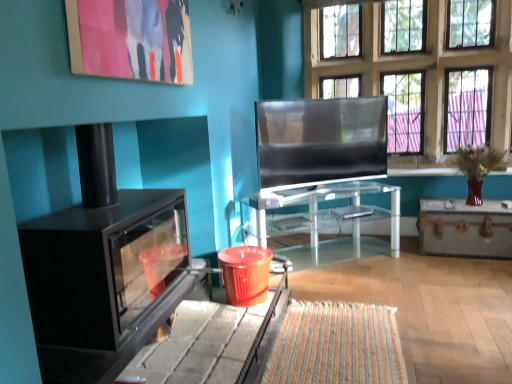
Question: Is matte black tv at center positioned with its back to black matte fireplace at left?

Choices:
 (A) no
 (B) yes

Answer: (A)

Question: Does matte black tv at center have a lesser height compared to black matte fireplace at left?

Choices:
 (A) yes
 (B) no

Answer: (A)

Question: Is black matte fireplace at left completely or partially inside matte black tv at center?

Choices:
 (A) yes
 (B) no

Answer: (B)

Question: Is matte black tv at center outside black matte fireplace at left?

Choices:
 (A) no
 (B) yes

Answer: (B)

Question: Is matte black tv at center to the right of black matte fireplace at left from the viewer's perspective?

Choices:
 (A) yes
 (B) no

Answer: (A)

Question: Considering the relative sizes of matte black tv at center and black matte fireplace at left in the image provided, is matte black tv at center bigger than black matte fireplace at left?

Choices:
 (A) no
 (B) yes

Answer: (A)

Question: Is metallic trunk at right, the second table when ordered from left to right, a part of matte acrylic painting at upper left?

Choices:
 (A) yes
 (B) no

Answer: (B)

Question: From a real-world perspective, is matte acrylic painting at upper left physically below metallic trunk at right, acting as the 1th table starting from the right?

Choices:
 (A) yes
 (B) no

Answer: (B)

Question: Does matte acrylic painting at upper left have a greater width compared to metallic trunk at right, the second table when ordered from left to right?

Choices:
 (A) yes
 (B) no

Answer: (B)

Question: Is matte acrylic painting at upper left positioned in front of metallic trunk at right, acting as the 1th table starting from the right?

Choices:
 (A) yes
 (B) no

Answer: (A)

Question: Considering the relative sizes of matte acrylic painting at upper left and metallic trunk at right, acting as the 1th table starting from the right, in the image provided, is matte acrylic painting at upper left taller than metallic trunk at right, acting as the 1th table starting from the right,?

Choices:
 (A) yes
 (B) no

Answer: (A)

Question: From a real-world perspective, is matte acrylic painting at upper left on top of metallic trunk at right, acting as the 1th table starting from the right?

Choices:
 (A) no
 (B) yes

Answer: (B)

Question: From the image's perspective, is matte black tv at center on metallic trunk at right, acting as the 1th table starting from the right?

Choices:
 (A) no
 (B) yes

Answer: (B)